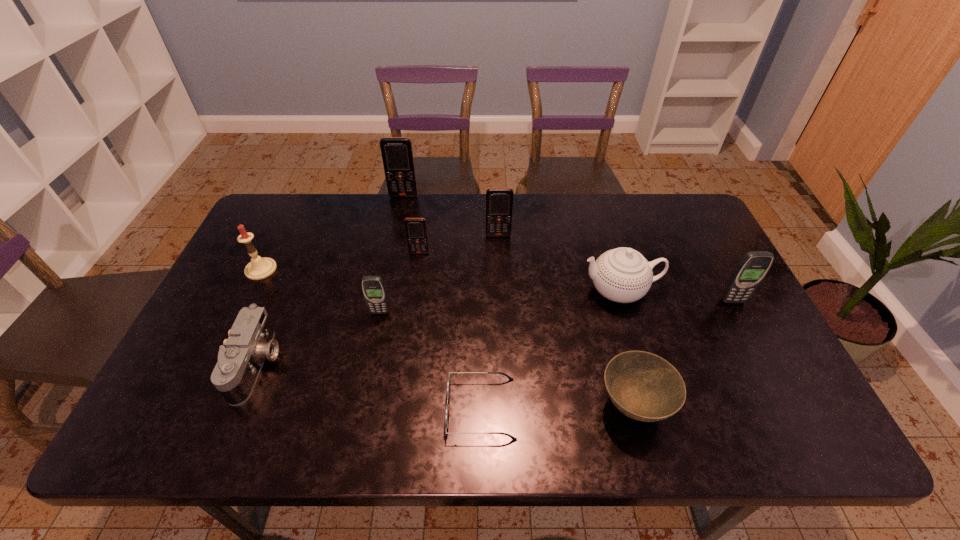
Find the location of a particular element. empty location between the second orange cellular telephone from right to left and the fourth cellular telephone from left to right is located at coordinates (459, 244).

Locate an element on the screen. This screenshot has width=960, height=540. vacant space that's between the second object from left to right and the chinaware is located at coordinates (439, 327).

You are a GUI agent. You are given a task and a screenshot of the screen. Output one action in this format:
    pyautogui.click(x=<x>, y=<y>)
    Task: Click on the free space between the chinaware and the third farthest cellular telephone
    The image size is (960, 540).
    Given the screenshot: What is the action you would take?
    pyautogui.click(x=519, y=272)

Where is `free area in between the bowl and the third nearest cellular telephone`? free area in between the bowl and the third nearest cellular telephone is located at coordinates (526, 329).

In order to click on blank region between the chinaware and the bigger gray cellular telephone in this screenshot , I will do `click(676, 296)`.

Find the location of a particular element. The width and height of the screenshot is (960, 540). unoccupied area between the smaller gray cellular telephone and the second object from left to right is located at coordinates (319, 339).

This screenshot has width=960, height=540. Find the location of `free space between the chinaware and the camera`. free space between the chinaware and the camera is located at coordinates (439, 327).

Where is `vacant area that lies between the farthest object and the nearer gray cellular telephone`? vacant area that lies between the farthest object and the nearer gray cellular telephone is located at coordinates (392, 254).

Identify which object is the fifth nearest to the shortest object. Please provide its 2D coordinates. Your answer should be formatted as a tuple, i.e. [(x, y)], where the tuple contains the x and y coordinates of a point satisfying the conditions above.

[(416, 232)]

Image resolution: width=960 pixels, height=540 pixels. I want to click on the ninth closest object relative to the chinaware, so click(x=259, y=268).